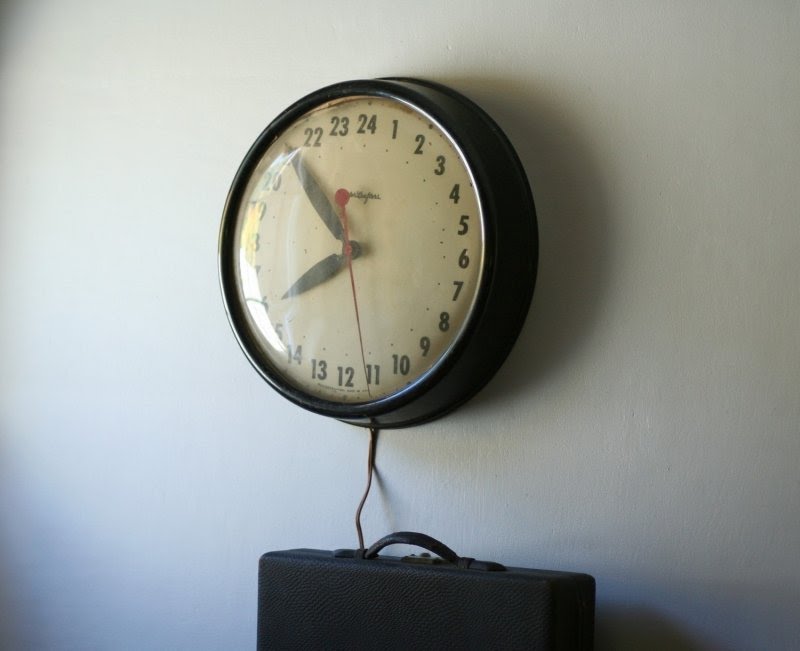
The height and width of the screenshot is (651, 800). I want to click on clock edge, so click(462, 153).